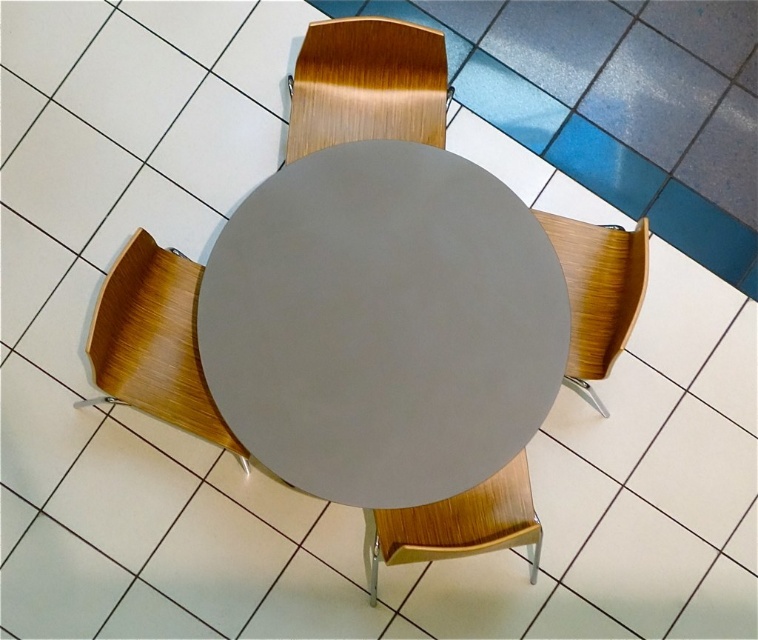
Question: Observing the image, what is the correct spatial positioning of wooden chair at lower left in reference to wooden chair at right?

Choices:
 (A) below
 (B) above

Answer: (A)

Question: Which point appears closest to the camera in this image?

Choices:
 (A) (177, 346)
 (B) (605, 273)

Answer: (A)

Question: Which object is positioned closest to the wooden chair at upper center?

Choices:
 (A) wooden chair at bottom
 (B) matte gray table at center
 (C) wooden chair at lower left

Answer: (B)

Question: In this image, where is matte gray table at center located relative to wooden chair at right?

Choices:
 (A) above
 (B) below

Answer: (A)

Question: Among these points, which one is nearest to the camera?

Choices:
 (A) (152, 252)
 (B) (277, 310)
 (C) (373, 513)
 (D) (608, 365)

Answer: (B)

Question: Does wooden chair at lower left appear under wooden chair at bottom?

Choices:
 (A) yes
 (B) no

Answer: (B)